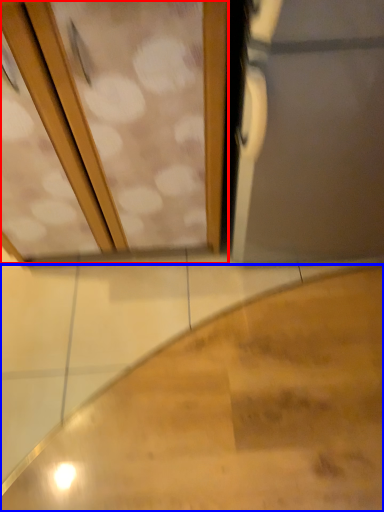
Question: Which point is further to the camera, screen door (highlighted by a red box) or stairs (highlighted by a blue box)?

Choices:
 (A) screen door
 (B) stairs

Answer: (B)